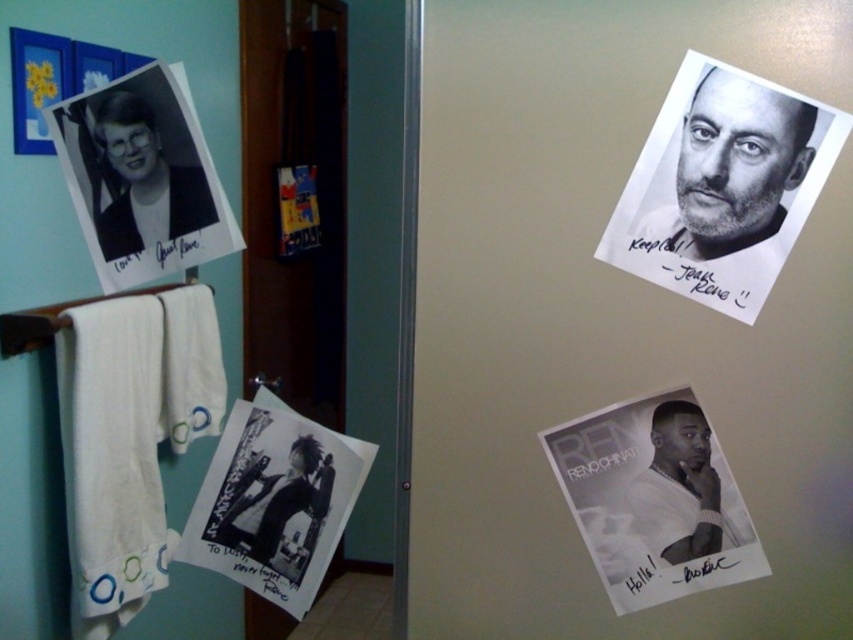
Question: Which point is closer to the camera?

Choices:
 (A) (102, 221)
 (B) (741, 157)
 (C) (161, 250)
 (D) (300, 497)

Answer: (D)

Question: Which object is closer to the camera taking this photo?

Choices:
 (A) matte black photo at left
 (B) white glossy photo of man at lower right
 (C) black paper at lower right
 (D) black paper at upper right

Answer: (A)

Question: Can you confirm if black paper at lower right is positioned below matte black photo at left?

Choices:
 (A) yes
 (B) no

Answer: (A)

Question: Which object is positioned closest to the matte black photo at left?

Choices:
 (A) black paper at upper left
 (B) black glossy photo at lower left

Answer: (A)

Question: Is black paper at upper right closer to the viewer compared to white glossy photo of man at lower right?

Choices:
 (A) yes
 (B) no

Answer: (A)

Question: Can you confirm if black paper at upper left is positioned to the left of black paper at upper right?

Choices:
 (A) no
 (B) yes

Answer: (B)